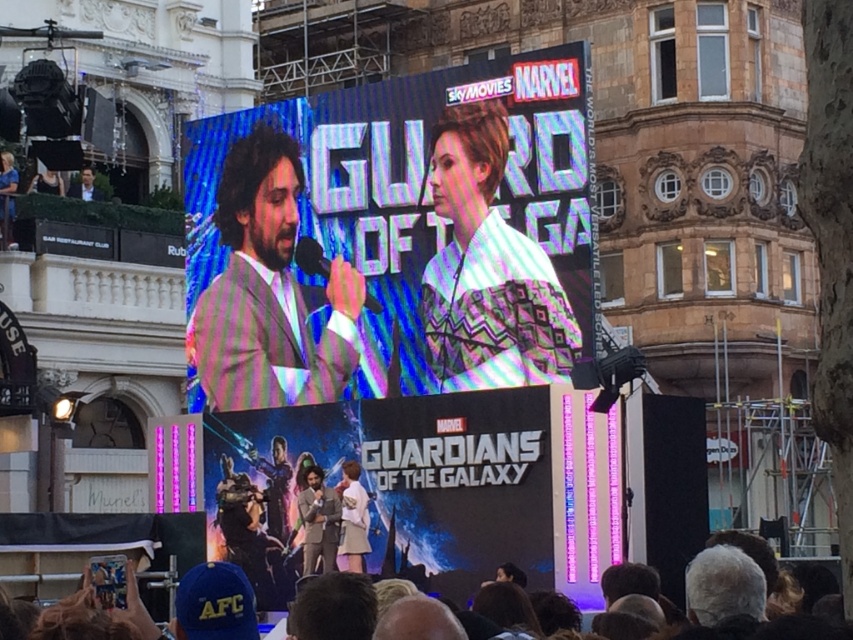
Question: Can you confirm if satin striped suit at center is wider than white fabric skirt at center?

Choices:
 (A) no
 (B) yes

Answer: (A)

Question: Does satin striped suit at center appear over matte black suit at center?

Choices:
 (A) no
 (B) yes

Answer: (B)

Question: Is matte digital screen at center positioned before dark brown hair at lower center?

Choices:
 (A) yes
 (B) no

Answer: (B)

Question: Which point is closer to the camera?

Choices:
 (A) matte digital screen at center
 (B) satin striped suit at center

Answer: (A)

Question: Based on their relative distances, which object is farther from the matte digital screen at center?

Choices:
 (A) matte black suit at center
 (B) white fabric skirt at center

Answer: (B)

Question: Among these points, which one is nearest to the camera?

Choices:
 (A) (351, 477)
 (B) (440, 388)
 (C) (1, 596)

Answer: (C)